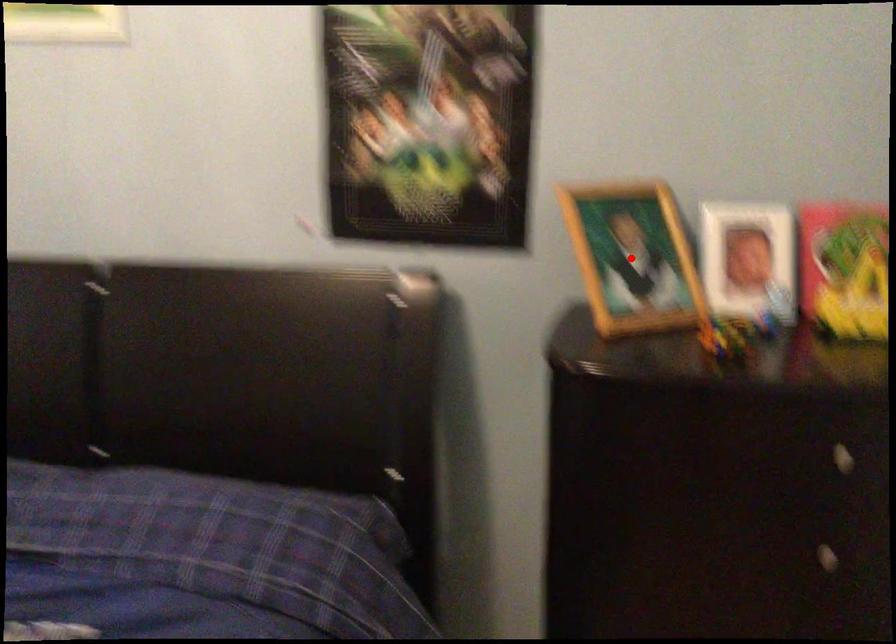
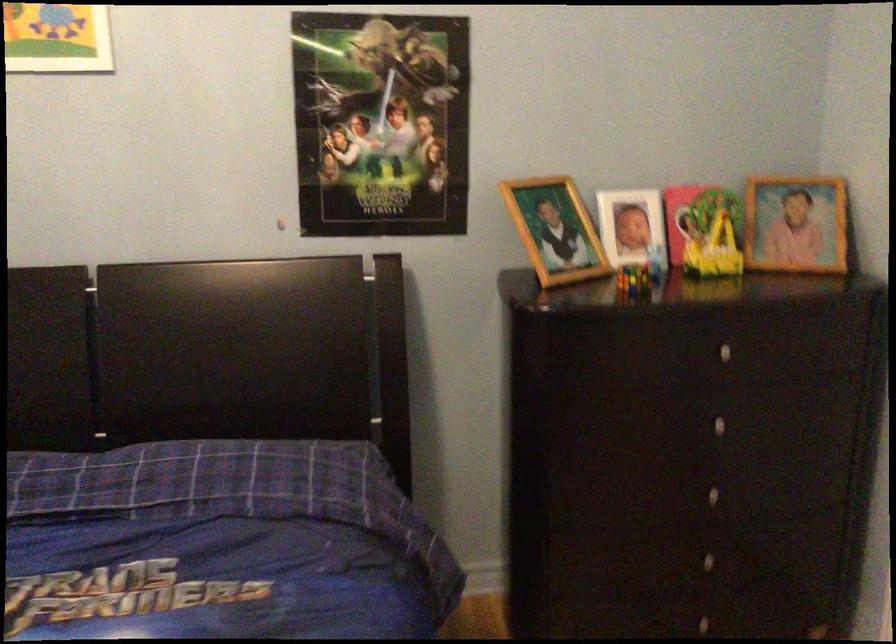
Where in the second image is the point corresponding to the highlighted location from the first image?

(555, 230)